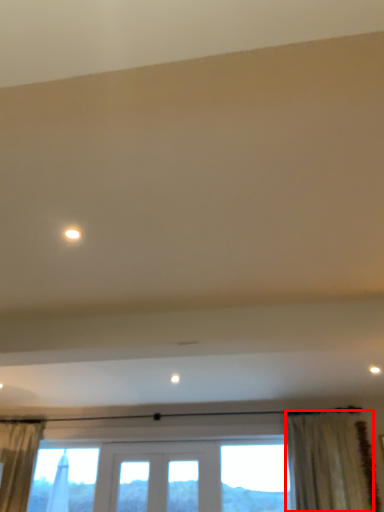
Question: From the image, what is the correct spatial relationship of curtain (annotated by the red box) in relation to light?

Choices:
 (A) left
 (B) right

Answer: (B)